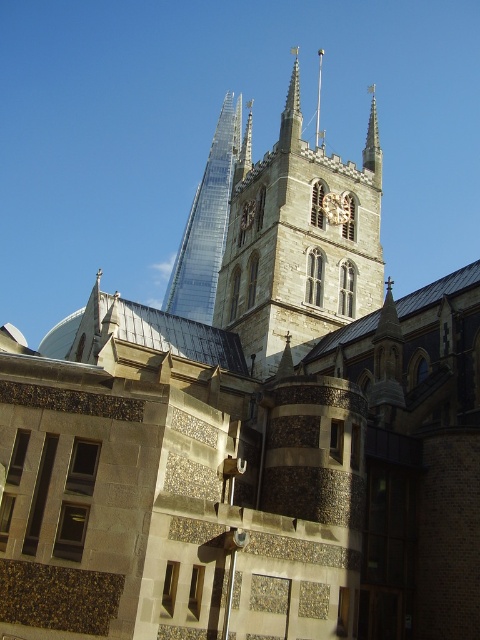
Does transparent glass tower at upper center appear under gold textured clock at center?

Actually, transparent glass tower at upper center is above gold textured clock at center.

How far apart are transparent glass tower at upper center and gold textured clock at center?

transparent glass tower at upper center and gold textured clock at center are 71.52 meters apart.

What do you see at coordinates (206, 224) in the screenshot? I see `transparent glass tower at upper center` at bounding box center [206, 224].

Identify the location of transparent glass tower at upper center. The image size is (480, 640). (206, 224).

Can you confirm if smooth stone spire at center is smaller than smooth glass spire at upper center?

Yes.

Who is positioned more to the left, smooth stone spire at center or smooth glass spire at upper center?

From the viewer's perspective, smooth stone spire at center appears more on the left side.

Locate an element on the screen. The height and width of the screenshot is (640, 480). smooth stone spire at center is located at coordinates (290, 113).

Does stone clock tower at center have a lesser width compared to transparent glass tower at upper center?

Yes.

Is point (276, 336) in front of point (217, 273)?

Yes, it is.

What are the coordinates of `stone clock tower at center` in the screenshot? It's located at (297, 253).